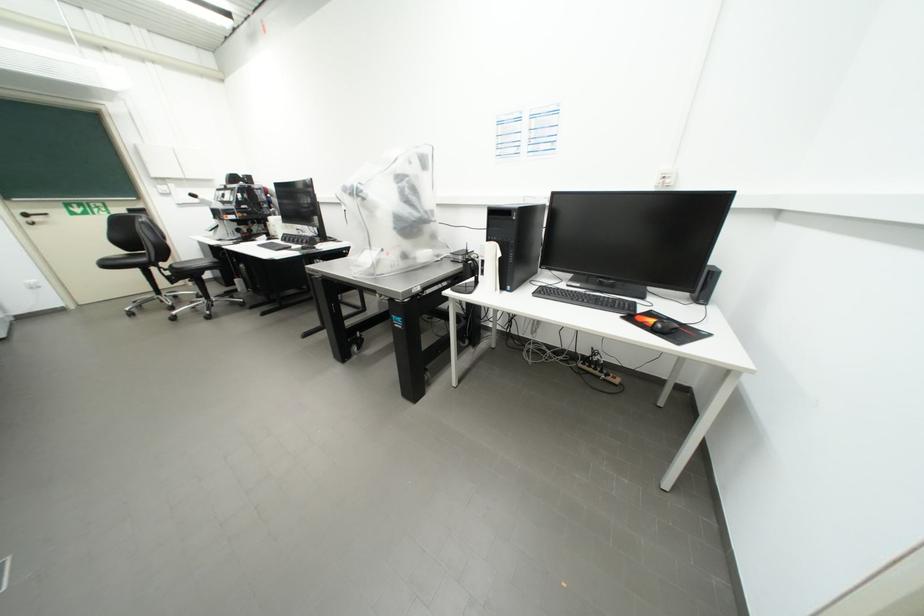
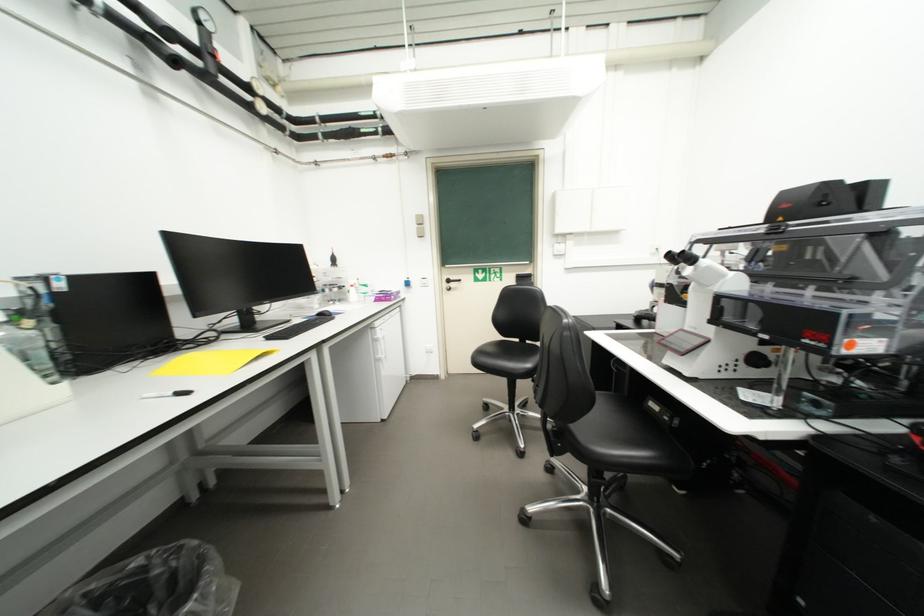
Where in the second image is the point corresponding to point 201,197 from the first image?

(687, 259)